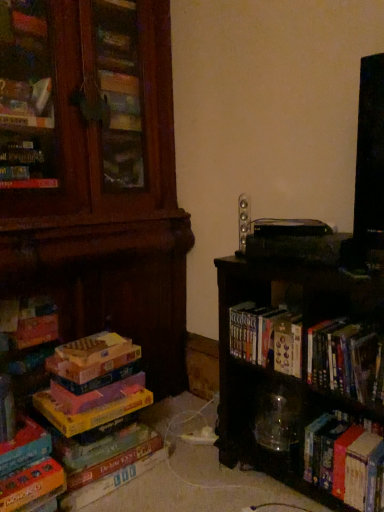
Question: From a real-world perspective, is hardcover books at center, marked as the 3th book in a left-to-right arrangement, physically located above or below multicolored cardboard at left, arranged as the 2th book when viewed from the left?

Choices:
 (A) above
 (B) below

Answer: (A)

Question: Based on their positions, is hardcover books at center, arranged as the third book when viewed from the right, located to the left or right of multicolored cardboard at left, arranged as the 2th book when viewed from the left?

Choices:
 (A) right
 (B) left

Answer: (A)

Question: Based on their relative distances, which object is farther from the hardcover book at lower right, positioned as the 1th book in right-to-left order?

Choices:
 (A) black matte bookshelf at right
 (B) hardcover books at center, marked as the 3th book in a left-to-right arrangement
 (C) multicolored cardboard at left, arranged as the 2th book when viewed from the left
 (D) hardcover book at right, which is the 2th book from right to left
 (E) satin silver speaker at upper center

Answer: (E)

Question: Estimate the real-world distances between objects in this image. Which object is closer to the orange cardboard monopoly game at lower left, the fifth book from the right?

Choices:
 (A) multicolored cardboard at left, arranged as the 2th book when viewed from the left
 (B) hardcover book at right, placed as the 4th book when sorted from left to right
 (C) hardcover books at center, marked as the 3th book in a left-to-right arrangement
 (D) black matte bookshelf at right
 (E) hardcover book at lower right, the 5th book when ordered from left to right

Answer: (A)